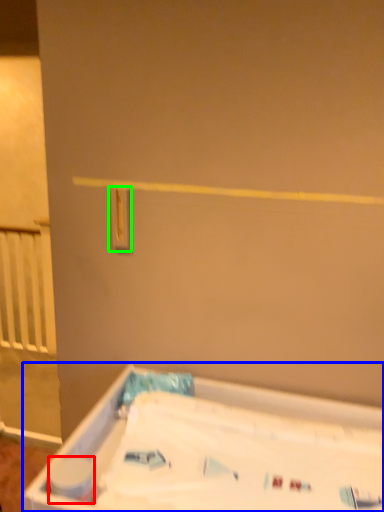
Question: Which object is the closest to the toilet paper (highlighted by a red box)? Choose among these: bathtub (highlighted by a blue box) or light switch (highlighted by a green box).

Choices:
 (A) bathtub
 (B) light switch

Answer: (A)